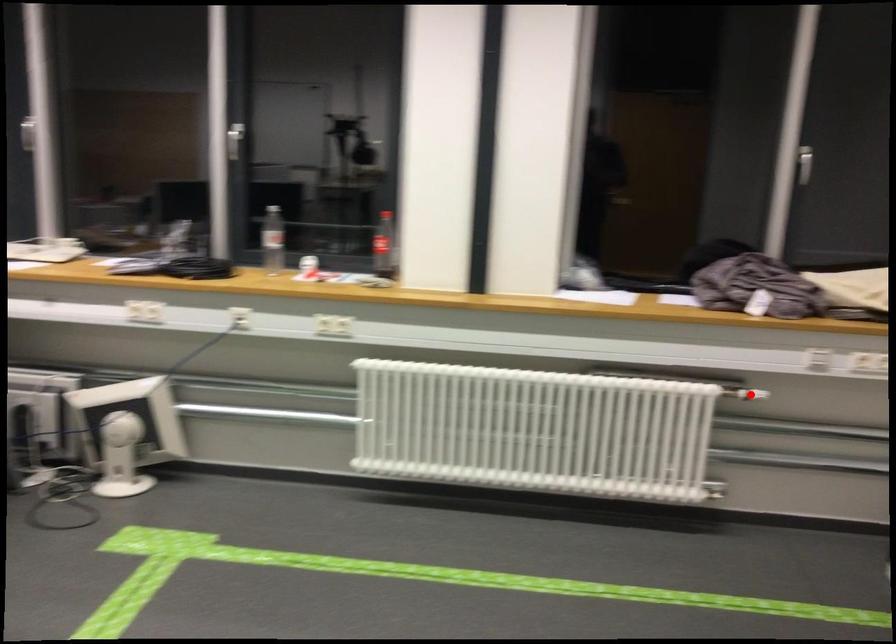
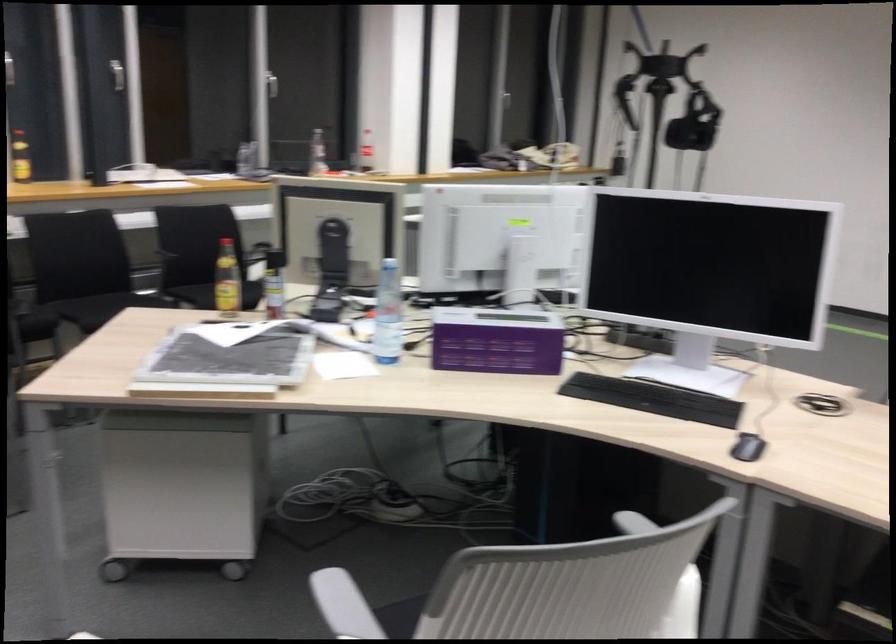
Question: I am providing you with two images of the same scene from different viewpoints. A red point is marked on the first image. Can you still see the location of the red point in image 2?

Choices:
 (A) Yes
 (B) No

Answer: (B)